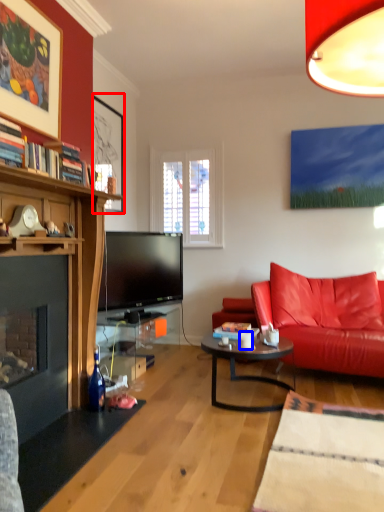
Question: Which object appears closest to the camera in this image, picture frame (highlighted by a red box) or coffee cup (highlighted by a blue box)?

Choices:
 (A) picture frame
 (B) coffee cup

Answer: (B)